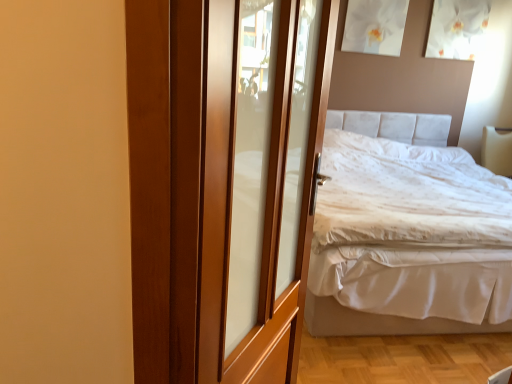
Question: Is point (132, 244) positioned closer to the camera than point (467, 190)?

Choices:
 (A) closer
 (B) farther

Answer: (A)

Question: Looking at the image, does wooden door at center seem bigger or smaller compared to white fabric bed at right?

Choices:
 (A) small
 (B) big

Answer: (A)

Question: From the image's perspective, is wooden door at center located above or below white fabric bed at right?

Choices:
 (A) above
 (B) below

Answer: (B)

Question: Would you say white fabric bed at right is to the left or to the right of wooden door at center in the picture?

Choices:
 (A) right
 (B) left

Answer: (A)

Question: In the image, is white fabric bed at right positioned in front of or behind wooden door at center?

Choices:
 (A) behind
 (B) front

Answer: (A)

Question: From a real-world perspective, is white fabric bed at right physically located above or below wooden door at center?

Choices:
 (A) below
 (B) above

Answer: (A)

Question: Choose the correct answer: Is white fabric bed at right inside wooden door at center or outside it?

Choices:
 (A) outside
 (B) inside

Answer: (A)